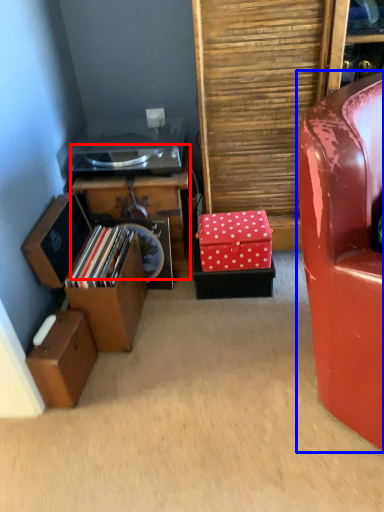
Question: Which object is closer to the camera taking this photo, furniture (highlighted by a red box) or chair (highlighted by a blue box)?

Choices:
 (A) furniture
 (B) chair

Answer: (B)